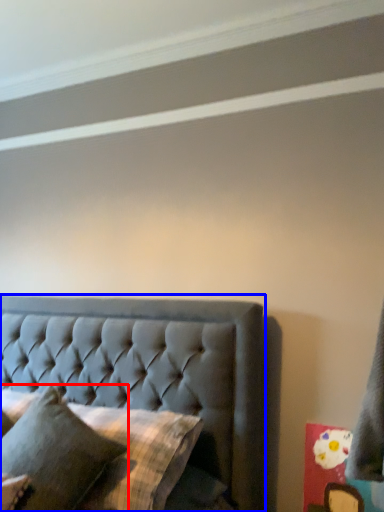
Question: Which of the following is the farthest to the observer, pillow (highlighted by a red box) or bed (highlighted by a blue box)?

Choices:
 (A) pillow
 (B) bed

Answer: (B)